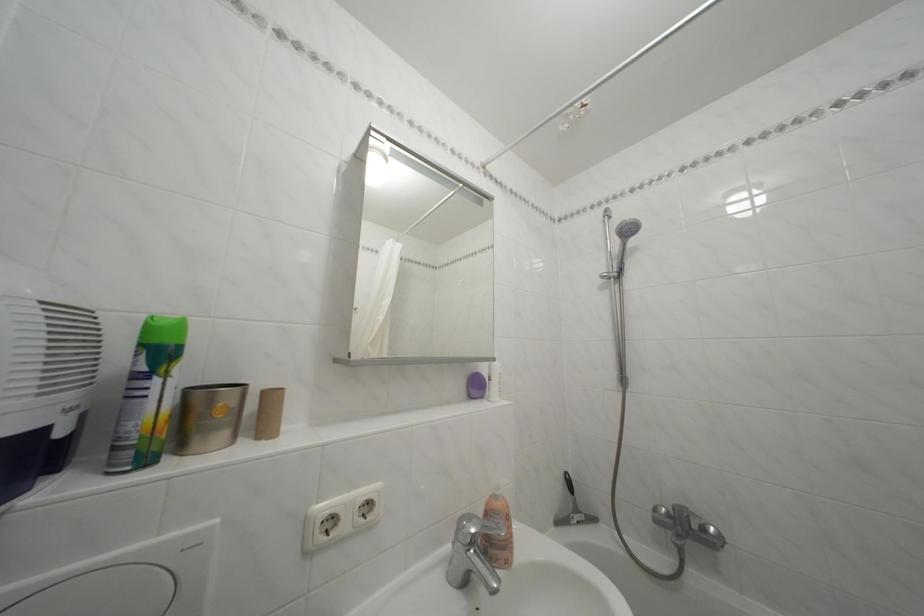
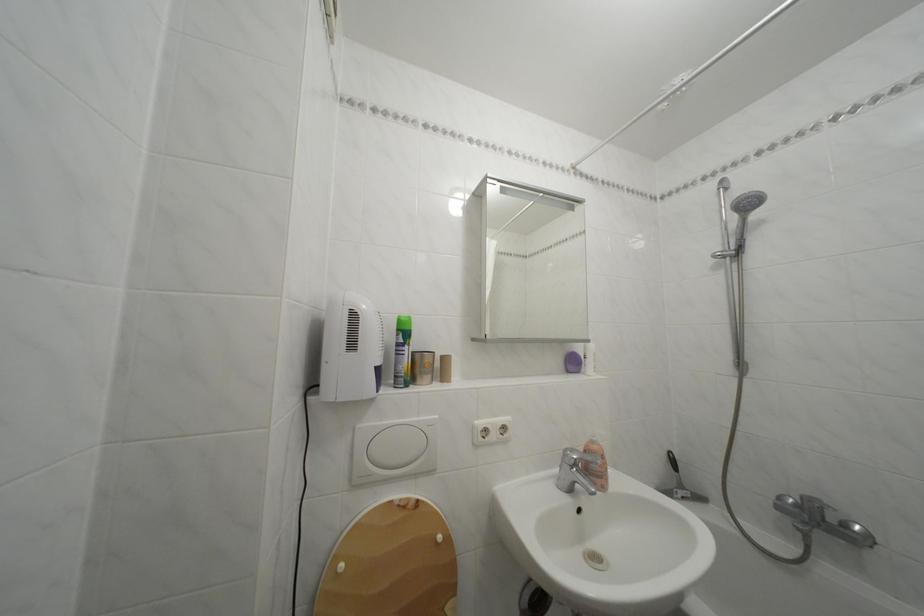
In the second image, find the point that corresponds to (505,504) in the first image.

(602, 448)